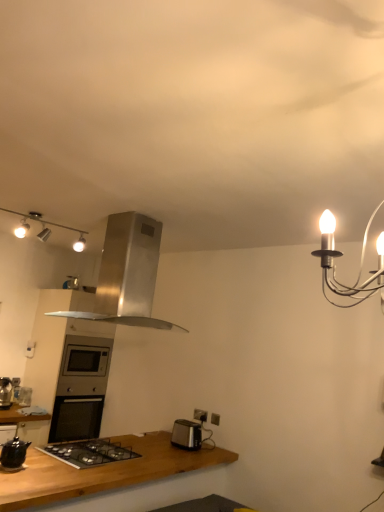
Question: Considering the relative positions of matte silver track lights at upper left and brown wooden countertop at lower left in the image provided, is matte silver track lights at upper left in front of brown wooden countertop at lower left?

Choices:
 (A) yes
 (B) no

Answer: (B)

Question: Considering the relative sizes of matte silver track lights at upper left and brown wooden countertop at lower left in the image provided, is matte silver track lights at upper left bigger than brown wooden countertop at lower left?

Choices:
 (A) yes
 (B) no

Answer: (B)

Question: Does matte silver track lights at upper left come behind brown wooden countertop at lower left?

Choices:
 (A) yes
 (B) no

Answer: (A)

Question: From the image's perspective, is matte silver track lights at upper left on top of brown wooden countertop at lower left?

Choices:
 (A) yes
 (B) no

Answer: (A)

Question: Does matte silver track lights at upper left have a lesser width compared to brown wooden countertop at lower left?

Choices:
 (A) no
 (B) yes

Answer: (B)

Question: Does matte silver track lights at upper left have a greater width compared to brown wooden countertop at lower left?

Choices:
 (A) no
 (B) yes

Answer: (A)

Question: Can you confirm if brown wooden countertop at lower left is positioned to the left of matte gray electric outlet at lower center, acting as the 1th electric outlet starting from the right?

Choices:
 (A) no
 (B) yes

Answer: (B)

Question: Is brown wooden countertop at lower left further to camera compared to matte gray electric outlet at lower center, the 2th electric outlet from the left?

Choices:
 (A) no
 (B) yes

Answer: (A)

Question: Is brown wooden countertop at lower left outside of matte gray electric outlet at lower center, acting as the 1th electric outlet starting from the right?

Choices:
 (A) yes
 (B) no

Answer: (A)

Question: Are brown wooden countertop at lower left and matte gray electric outlet at lower center, which is the 1th electric outlet from front to back, located far from each other?

Choices:
 (A) yes
 (B) no

Answer: (B)

Question: Does brown wooden countertop at lower left have a lesser width compared to matte gray electric outlet at lower center, acting as the 1th electric outlet starting from the right?

Choices:
 (A) no
 (B) yes

Answer: (A)

Question: Is the surface of brown wooden countertop at lower left in direct contact with matte gray electric outlet at lower center, the 2th electric outlet from the left?

Choices:
 (A) no
 (B) yes

Answer: (A)

Question: Is satin silver oven at center positioned beyond the bounds of matte silver track lights at upper left?

Choices:
 (A) no
 (B) yes

Answer: (B)